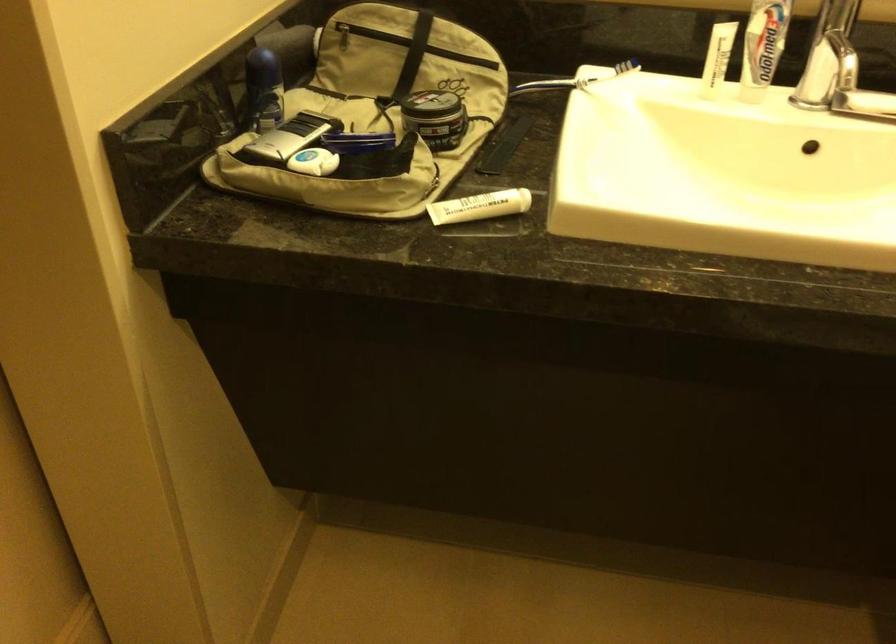
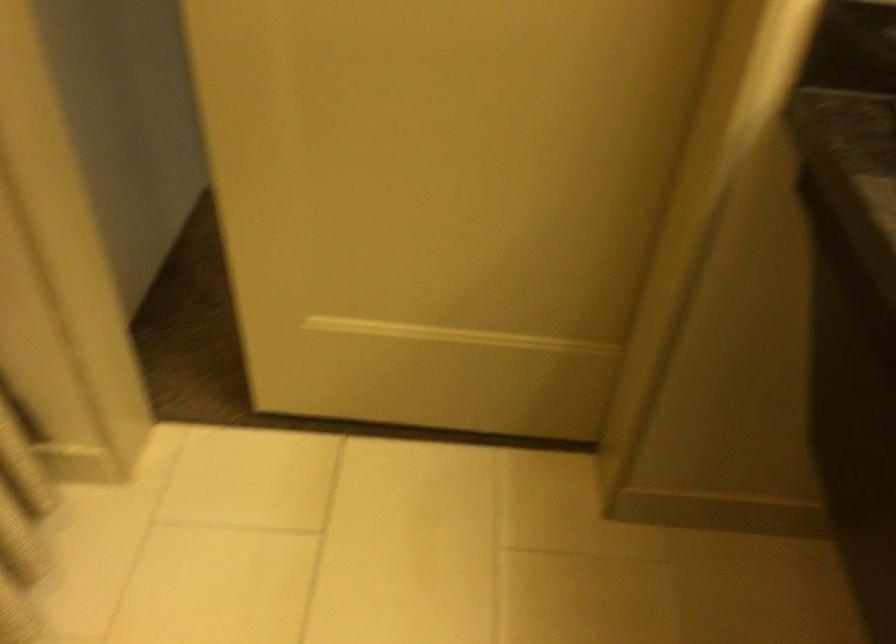
First-person continuous shooting, in which direction is the camera rotating?

The camera rotated toward left-down.